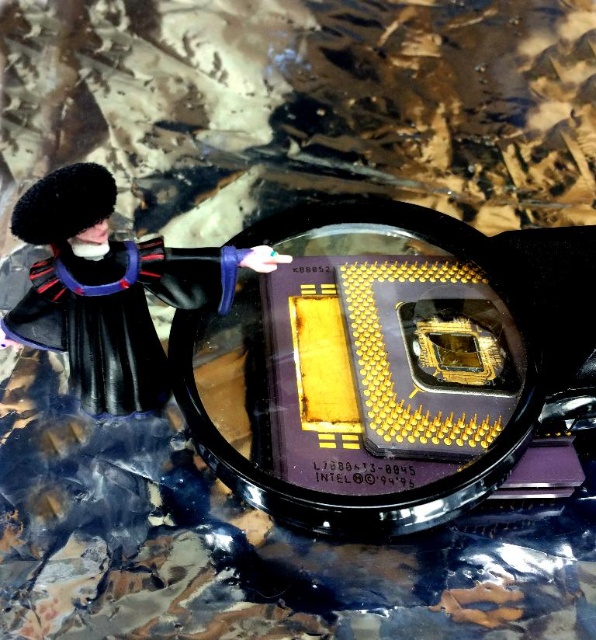
Question: Can you confirm if black plastic magnifying glass at center is positioned below black matte toy at left?

Choices:
 (A) yes
 (B) no

Answer: (A)

Question: Does black plastic magnifying glass at center have a greater width compared to black matte toy at left?

Choices:
 (A) no
 (B) yes

Answer: (B)

Question: Which point is closer to the camera?

Choices:
 (A) black matte toy at left
 (B) black plastic magnifying glass at center

Answer: (A)

Question: Is black plastic magnifying glass at center above black matte toy at left?

Choices:
 (A) no
 (B) yes

Answer: (A)

Question: Which point is farther to the camera?

Choices:
 (A) black plastic magnifying glass at center
 (B) black matte toy at left

Answer: (A)